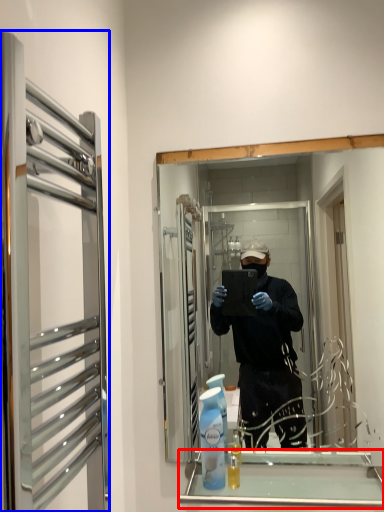
Question: Which of the following is the farthest to the observer, cabinet (highlighted by a red box) or glass door (highlighted by a blue box)?

Choices:
 (A) cabinet
 (B) glass door

Answer: (A)